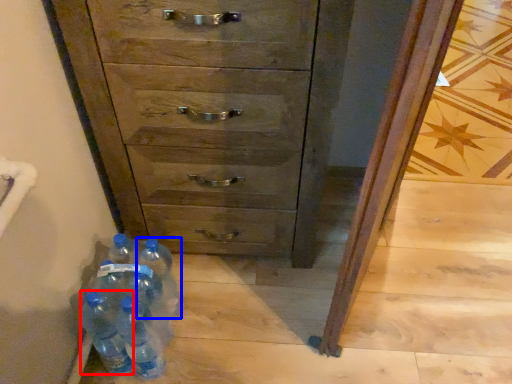
Question: Among these objects, which one is nearest to the camera, bottle (highlighted by a red box) or bottle (highlighted by a blue box)?

Choices:
 (A) bottle
 (B) bottle

Answer: (A)